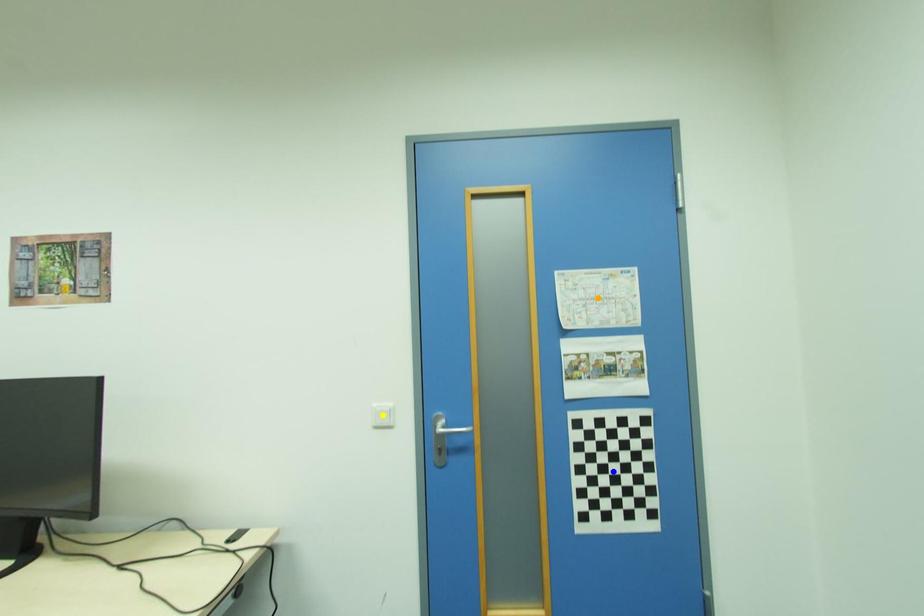
Order these from nearest to farthest:
blue point
yellow point
orange point

blue point < orange point < yellow point